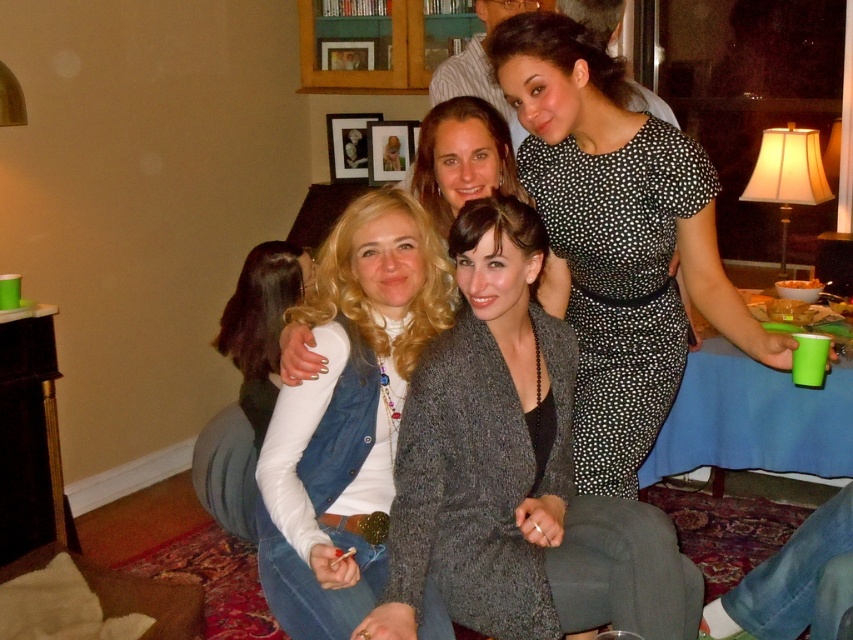
Question: Does black dotted dress at upper center have a larger size compared to matte white sweater at center?

Choices:
 (A) yes
 (B) no

Answer: (A)

Question: Which point is closer to the camera taking this photo?

Choices:
 (A) (375, 593)
 (B) (267, 298)

Answer: (A)

Question: Which object is positioned farthest from the denim vest at center?

Choices:
 (A) matte white sweater at center
 (B) black dotted dress at upper center

Answer: (A)

Question: Is black dotted dress at upper center above matte white sweater at center?

Choices:
 (A) yes
 (B) no

Answer: (A)

Question: Is denim vest at center to the right of matte white sweater at center from the viewer's perspective?

Choices:
 (A) yes
 (B) no

Answer: (A)

Question: Which point is closer to the camera?

Choices:
 (A) (293, 292)
 (B) (604, 125)
 (C) (326, 564)

Answer: (C)